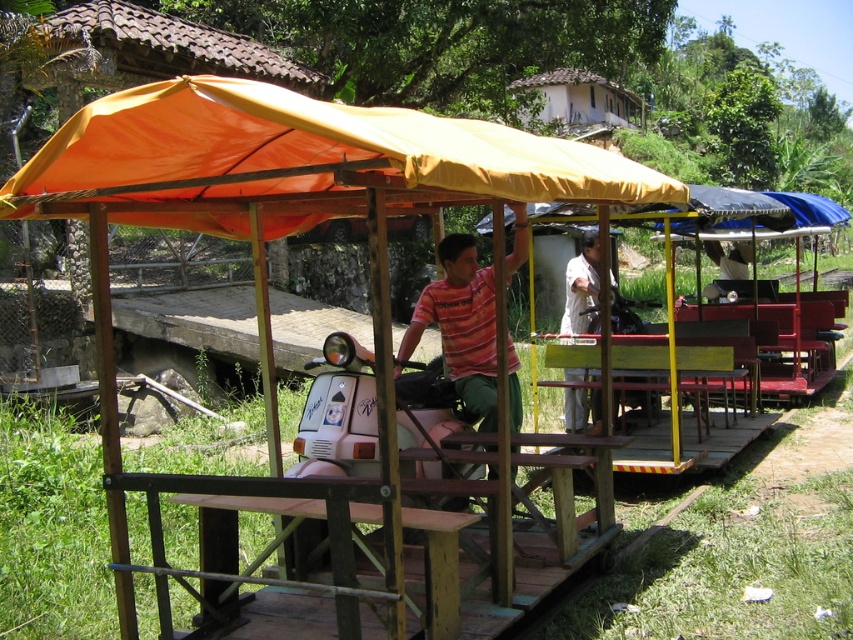
This screenshot has height=640, width=853. Describe the element at coordinates (305, 156) in the screenshot. I see `orange fabric canopy at upper center` at that location.

Is orange fabric canopy at upper center further to the viewer compared to white matte shirt at center?

No.

Identify the location of orange fabric canopy at upper center. (305, 156).

You are a GUI agent. You are given a task and a screenshot of the screen. Output one action in this format:
    pyautogui.click(x=<x>, y=<y>)
    Task: Click on the orange fabric canopy at upper center
    This screenshot has width=853, height=640.
    Given the screenshot: What is the action you would take?
    pyautogui.click(x=305, y=156)